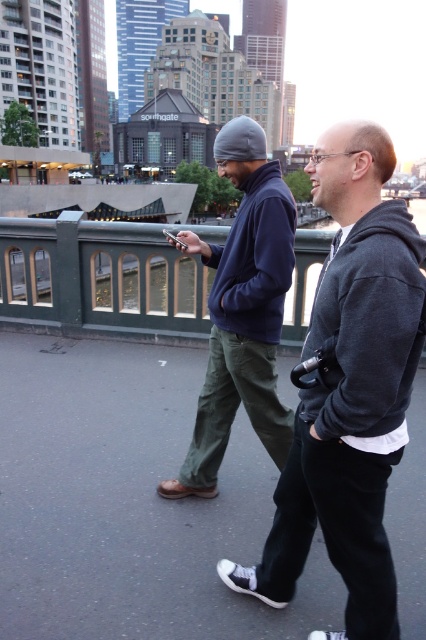
Question: Does navy blue fleece at center have a smaller size compared to green matte railing at center?

Choices:
 (A) no
 (B) yes

Answer: (B)

Question: Which of the following is the farthest from the observer?

Choices:
 (A) navy fleece sweatshirt at center
 (B) dark gray hoodie at center
 (C) dark gray fleece at center
 (D) navy blue fleece at center

Answer: (D)

Question: Observing the image, what is the correct spatial positioning of navy blue fleece at center in reference to navy fleece sweatshirt at center?

Choices:
 (A) right
 (B) left

Answer: (B)

Question: Which point is closer to the camera?

Choices:
 (A) dark gray hoodie at center
 (B) navy blue fleece at center
 (C) green matte railing at center

Answer: (A)

Question: Among these points, which one is nearest to the camera?

Choices:
 (A) (317, 333)
 (B) (351, 381)
 (C) (109, 272)

Answer: (B)

Question: Where is dark gray hoodie at center located in relation to navy fleece sweatshirt at center in the image?

Choices:
 (A) right
 (B) left

Answer: (A)